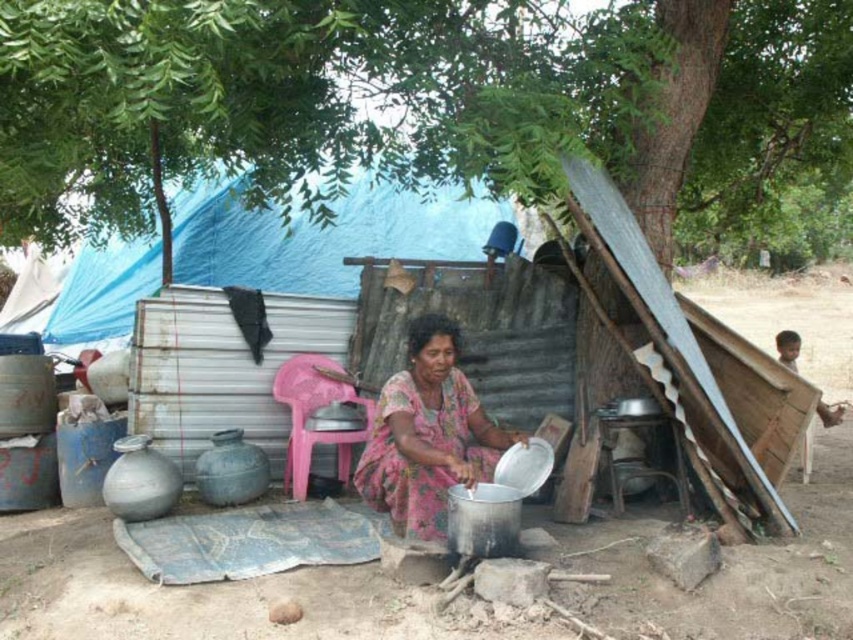
Question: Estimate the real-world distances between objects in this image. Which object is farther from the pink fabric dress at center?

Choices:
 (A) green leafy tree at upper left
 (B) blue tarpaulin tent at upper center

Answer: (B)

Question: In this image, where is green leafy tree at upper left located relative to blue tarpaulin tent at upper center?

Choices:
 (A) below
 (B) above

Answer: (B)

Question: Which point is closer to the camera?

Choices:
 (A) (x=126, y=317)
 (B) (x=479, y=442)
 (C) (x=227, y=3)

Answer: (C)

Question: Does green leafy tree at upper left appear on the right side of blue tarpaulin tent at upper center?

Choices:
 (A) yes
 (B) no

Answer: (A)

Question: Is green leafy tree at upper left wider than blue tarpaulin tent at upper center?

Choices:
 (A) yes
 (B) no

Answer: (B)

Question: Which point is closer to the camera taking this photo?

Choices:
 (A) (393, 401)
 (B) (335, 262)
 (C) (662, 72)

Answer: (A)